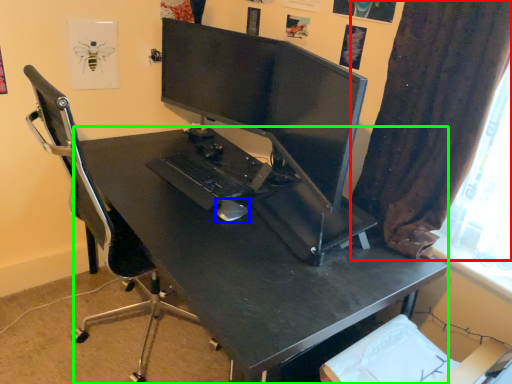
Question: Considering the real-world distances, which object is farthest from curtain (highlighted by a red box)? mouse (highlighted by a blue box) or desk (highlighted by a green box)?

Choices:
 (A) mouse
 (B) desk

Answer: (A)